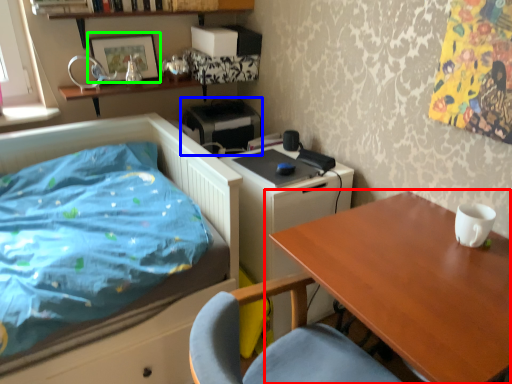
Question: Estimate the real-world distances between objects in this image. Which object is closer to table (highlighted by a red box), printer (highlighted by a blue box) or picture frame (highlighted by a green box)?

Choices:
 (A) printer
 (B) picture frame

Answer: (A)